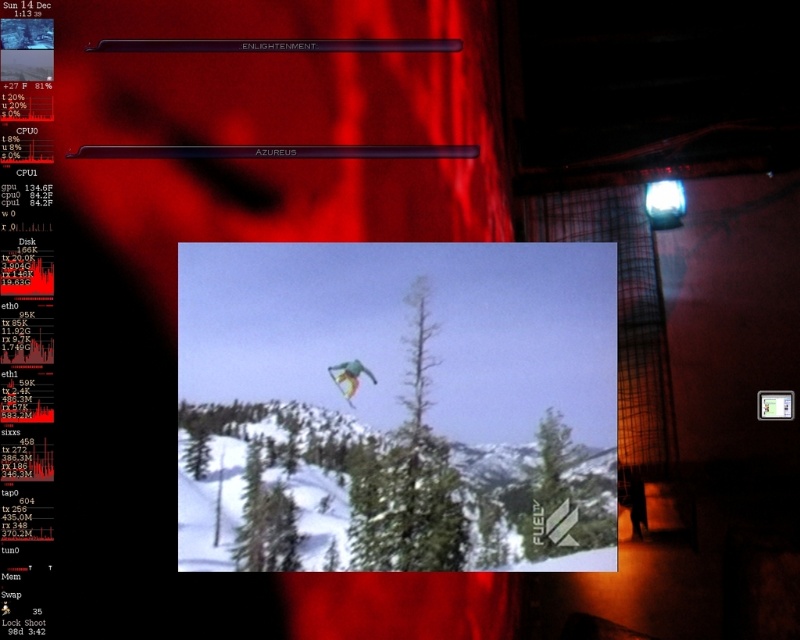
Is green fabric kite at center shorter than multicolored fabric snowboarder at center?

Incorrect, green fabric kite at center's height does not fall short of multicolored fabric snowboarder at center's.

Is green fabric kite at center positioned in front of multicolored fabric snowboarder at center?

That is True.

This screenshot has width=800, height=640. What do you see at coordinates (398, 404) in the screenshot?
I see `green fabric kite at center` at bounding box center [398, 404].

You are a GUI agent. You are given a task and a screenshot of the screen. Output one action in this format:
    pyautogui.click(x=<x>, y=<y>)
    Task: Click on the green fabric kite at center
    This screenshot has width=800, height=640.
    Given the screenshot: What is the action you would take?
    pyautogui.click(x=398, y=404)